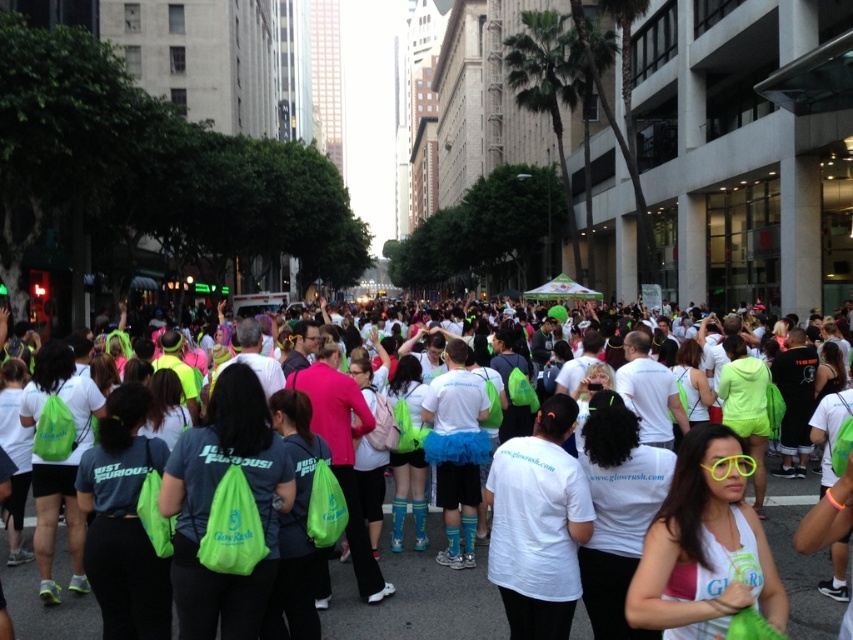
You are a participant in the event and notice two items at the center of the scene. The items are the green fabric bag at center and the neon yellow plastic sunglasses at center. Which item is positioned to the left when viewed from your perspective?

The green fabric bag at center is positioned to the left of the neon yellow plastic sunglasses at center.

You are a participant in the event and you want to pick up the neon yellow plastic sunglasses at center. However, there is a green fabric bag at center in the way. Can you reach the sunglasses without moving the bag?

The green fabric bag at center is further to the viewer than neon yellow plastic sunglasses at center, so the sunglasses are closer to you. Therefore, you can reach the sunglasses without moving the bag.